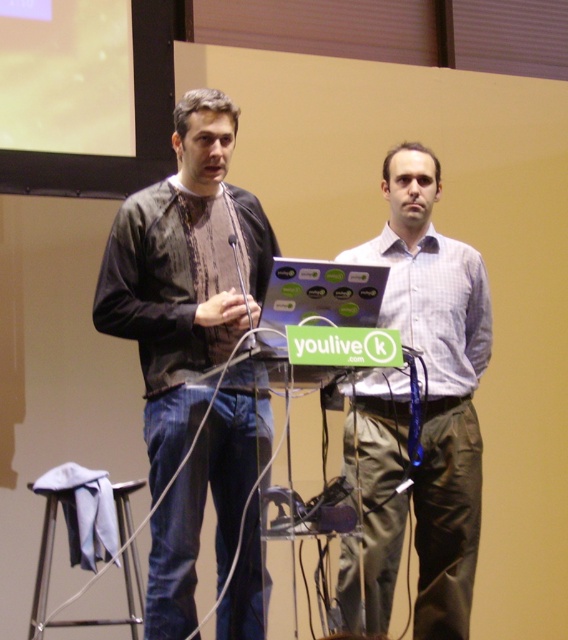
Is dark brown leather jacket at left in front of yellow matte projection screen at upper left?

Yes, it is.

Could you measure the distance between dark brown leather jacket at left and yellow matte projection screen at upper left?

3.52 feet

Locate an element on the screen. dark brown leather jacket at left is located at coordinates (185, 275).

Can you confirm if dark brown leather jacket at left is positioned to the left of metallic silver stool at lower left?

No, dark brown leather jacket at left is not to the left of metallic silver stool at lower left.

Between dark brown leather jacket at left and metallic silver stool at lower left, which one is positioned higher?

dark brown leather jacket at left is higher up.

Is point (172, 472) behind point (44, 586)?

No, it is in front of (44, 586).

Locate an element on the screen. The width and height of the screenshot is (568, 640). dark brown leather jacket at left is located at coordinates (185, 275).

Is yellow matte projection screen at upper left shorter than metallic silver stool at lower left?

No, yellow matte projection screen at upper left is not shorter than metallic silver stool at lower left.

Who is more distant from viewer, (x=115, y=36) or (x=48, y=582)?

Point (x=115, y=36)

Between point (43, 136) and point (45, 554), which one is positioned in front?

Point (45, 554)

I want to click on yellow matte projection screen at upper left, so click(x=66, y=76).